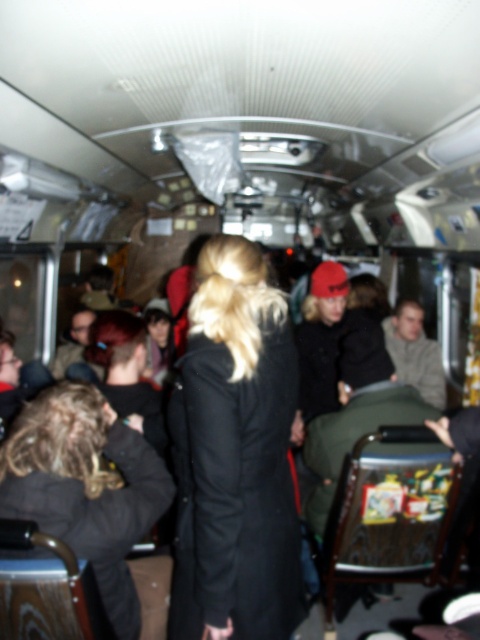
Does black wool coat at center have a smaller size compared to dark brown leather jacket at lower left?

Indeed, black wool coat at center has a smaller size compared to dark brown leather jacket at lower left.

Does black wool coat at center have a lesser height compared to dark brown leather jacket at lower left?

In fact, black wool coat at center may be taller than dark brown leather jacket at lower left.

Is point (191, 532) positioned behind point (90, 508)?

No, (191, 532) is in front of (90, 508).

Where is `black wool coat at center`? Image resolution: width=480 pixels, height=640 pixels. black wool coat at center is located at coordinates (235, 452).